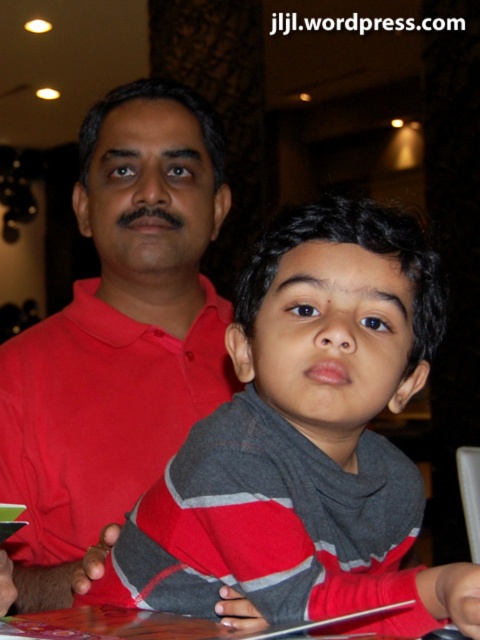
Question: Is red matte shirt at center to the right of wooden table at lower center from the viewer's perspective?

Choices:
 (A) no
 (B) yes

Answer: (A)

Question: Among these points, which one is nearest to the camera?

Choices:
 (A) (63, 570)
 (B) (408, 513)

Answer: (B)

Question: Estimate the real-world distances between objects in this image. Which object is farther from the red matte shirt at center?

Choices:
 (A) gray/red striped sweater at center
 (B) wooden table at lower center

Answer: (B)

Question: Which point appears closest to the camera in this image?

Choices:
 (A) click(274, 413)
 (B) click(148, 298)
 (C) click(83, 628)

Answer: (C)

Question: Does gray/red striped sweater at center have a lesser width compared to wooden table at lower center?

Choices:
 (A) yes
 (B) no

Answer: (B)

Question: Does gray/red striped sweater at center come in front of wooden table at lower center?

Choices:
 (A) no
 (B) yes

Answer: (A)